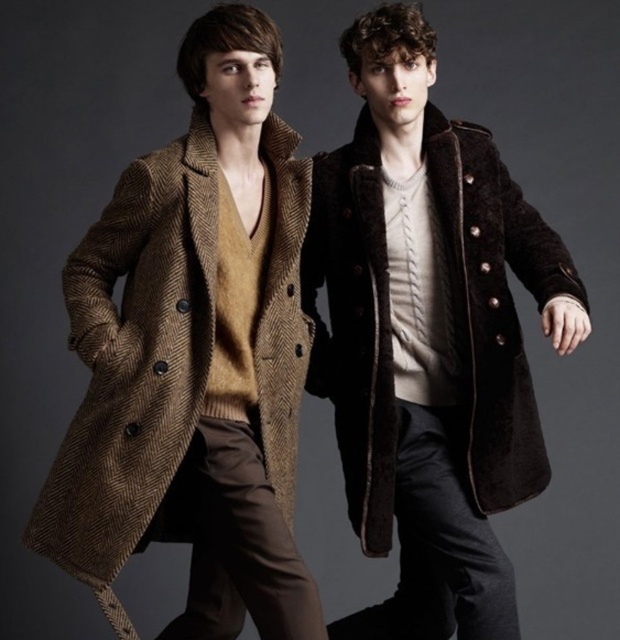
Question: Which point is farther to the camera?

Choices:
 (A) (459, 202)
 (B) (262, 332)

Answer: (A)

Question: Does herringbone wool coat at left have a greater width compared to brown woolen coat at center?

Choices:
 (A) yes
 (B) no

Answer: (B)

Question: In this image, where is herringbone wool coat at left located relative to brown woolen coat at center?

Choices:
 (A) below
 (B) above

Answer: (A)

Question: Which of the following is the farthest from the observer?

Choices:
 (A) herringbone wool coat at left
 (B) brown woolen coat at center

Answer: (B)

Question: Can you confirm if herringbone wool coat at left is thinner than brown woolen coat at center?

Choices:
 (A) yes
 (B) no

Answer: (A)

Question: Which point is closer to the camera?

Choices:
 (A) (286, 291)
 (B) (525, 481)

Answer: (A)